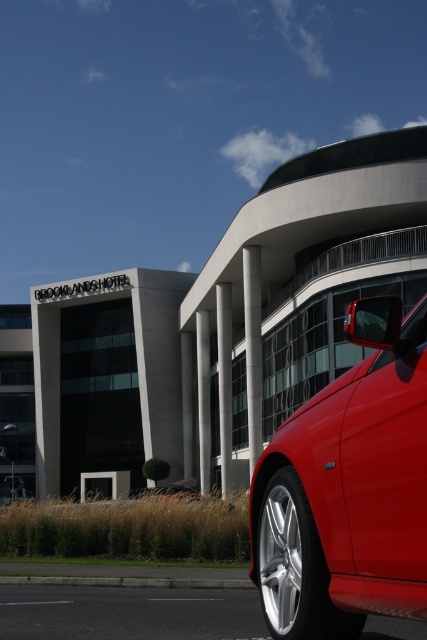
Can you confirm if grassy park at lower left is positioned below gray concrete pillar at center?

Correct, grassy park at lower left is located below gray concrete pillar at center.

Which of these two, grassy park at lower left or gray concrete pillar at center, stands shorter?

With less height is grassy park at lower left.

Who is more forward, (151, 520) or (201, 474)?

Positioned in front is point (151, 520).

At what (x,y) coordinates should I click in order to perform the action: click on grassy park at lower left. Please return your answer as a coordinate pair (x, y). The width and height of the screenshot is (427, 640). Looking at the image, I should click on (128, 528).

Between white smooth pillar at center and satin silver column at center, which one has more height?

Standing taller between the two is white smooth pillar at center.

Is white smooth pillar at center taller than satin silver column at center?

Yes.

Between point (224, 346) and point (193, 465), which one is positioned behind?

The point (193, 465) is behind.

Where is `white smooth pillar at center`? The height and width of the screenshot is (640, 427). white smooth pillar at center is located at coordinates (225, 380).

Does gray concrete pillar at center appear on the left side of satin silver column at center?

In fact, gray concrete pillar at center is to the right of satin silver column at center.

Is gray concrete pillar at center further to the viewer compared to satin silver column at center?

No, it is not.

Between point (198, 413) and point (192, 368), which one is positioned behind?

Point (192, 368)

Identify the location of gray concrete pillar at center. The width and height of the screenshot is (427, 640). (204, 397).